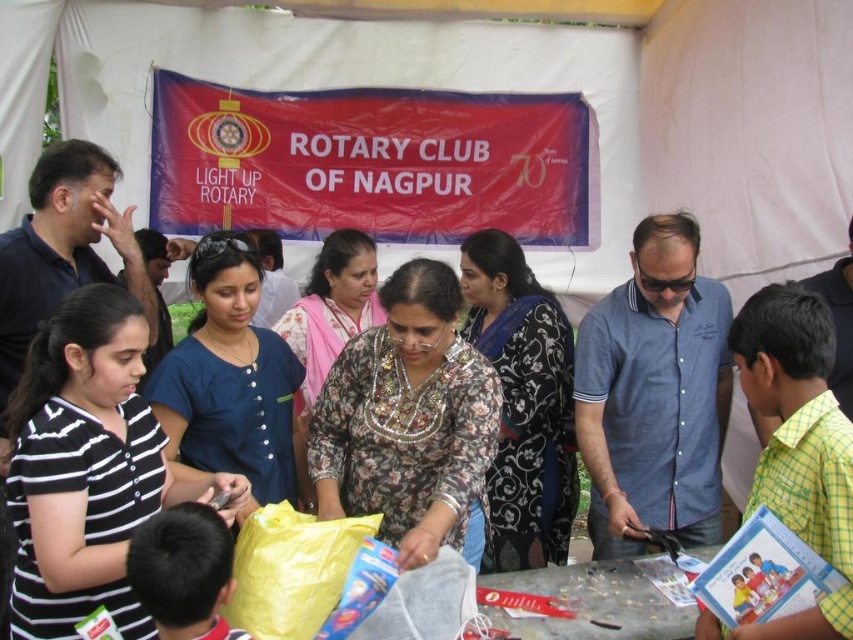
Question: Which point is closer to the camera?

Choices:
 (A) black striped shirt at lower left
 (B) floral fabric saree at center
 (C) blue fabric shirt at center

Answer: (A)

Question: Is black striped shirt at lower left to the left of wooden table at center from the viewer's perspective?

Choices:
 (A) no
 (B) yes

Answer: (B)

Question: Is floral printed dress at center thinner than floral fabric saree at center?

Choices:
 (A) yes
 (B) no

Answer: (B)

Question: Among these points, which one is nearest to the camera?

Choices:
 (A) (808, 296)
 (B) (668, 224)
 (C) (368, 436)
 (D) (653, 627)

Answer: (A)

Question: Is black striped shirt at lower left below floral fabric saree at center?

Choices:
 (A) yes
 (B) no

Answer: (A)

Question: Among these objects, which one is farthest from the camera?

Choices:
 (A) black floral dress at center
 (B) blue denim shirt at center

Answer: (A)